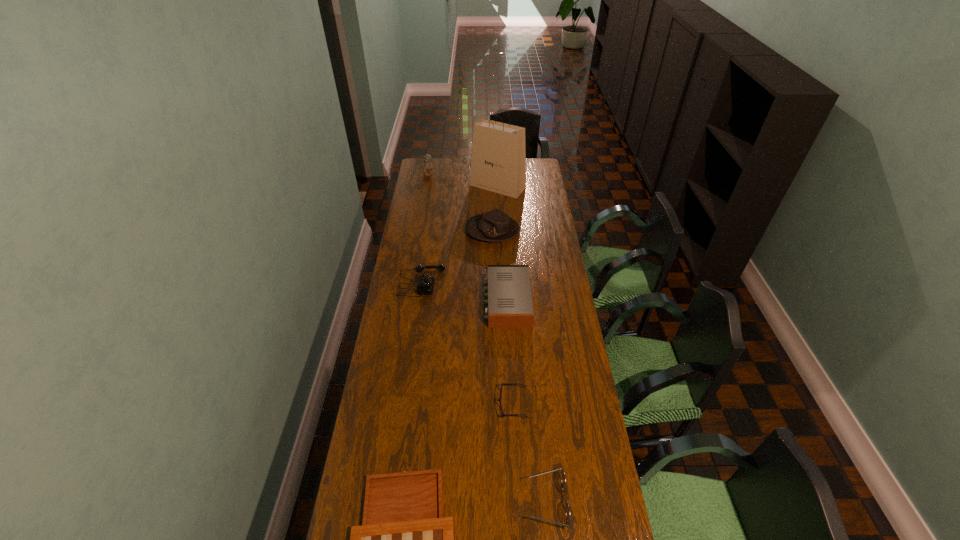
Where is `free location that satisfies the following two spatial constraints: 1. on the front-facing side of the shopping bag; 2. on the right side of the teddy bear`? free location that satisfies the following two spatial constraints: 1. on the front-facing side of the shopping bag; 2. on the right side of the teddy bear is located at coordinates (426, 186).